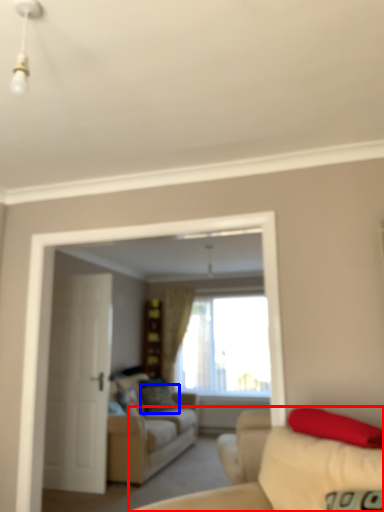
Question: Which object is closer to the camera taking this photo, studio couch (highlighted by a red box) or pillow (highlighted by a blue box)?

Choices:
 (A) studio couch
 (B) pillow

Answer: (A)